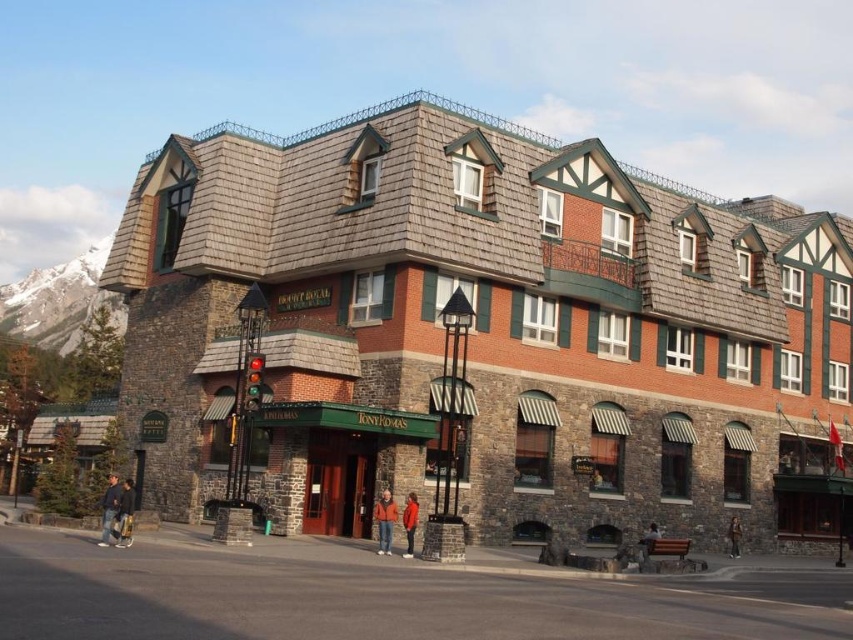
In the scene shown: Who is more distant from viewer, (379, 528) or (740, 552)?

Positioned behind is point (740, 552).

Locate an element on the screen. The width and height of the screenshot is (853, 640). orange fabric jacket at lower center is located at coordinates (386, 520).

What do you see at coordinates (109, 508) in the screenshot?
I see `denim jacket at lower left` at bounding box center [109, 508].

Is denim jacket at lower left below orange jacket at center?

Actually, denim jacket at lower left is above orange jacket at center.

Is point (109, 506) behind point (415, 522)?

That is False.

I want to click on denim jacket at lower left, so click(x=109, y=508).

Does dark blue jeans at lower left have a lesser height compared to orange fabric jacket at lower center?

In fact, dark blue jeans at lower left may be taller than orange fabric jacket at lower center.

Is dark blue jeans at lower left smaller than orange fabric jacket at lower center?

No, dark blue jeans at lower left is not smaller than orange fabric jacket at lower center.

Between point (117, 536) and point (384, 518), which one is positioned in front?

Point (117, 536)

Where is `dark blue jeans at lower left`? dark blue jeans at lower left is located at coordinates (125, 515).